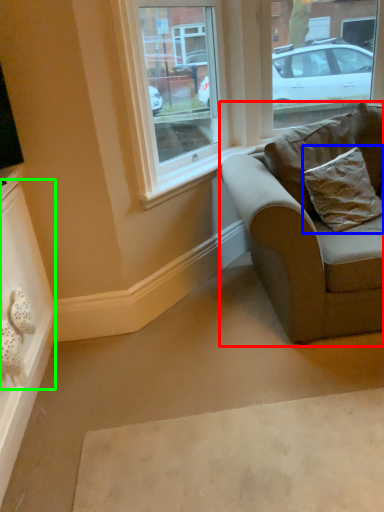
Question: Considering the real-world distances, which object is farthest from studio couch (highlighted by a red box)? pillow (highlighted by a blue box) or drawer (highlighted by a green box)?

Choices:
 (A) pillow
 (B) drawer

Answer: (B)